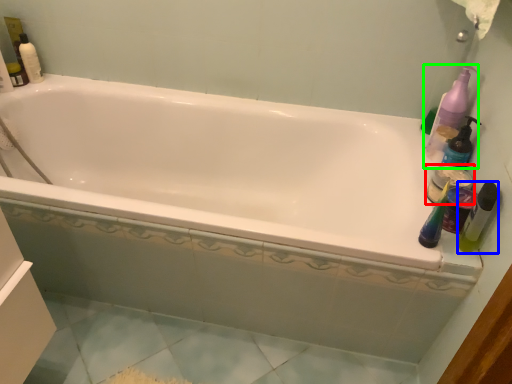
Question: Estimate the real-world distances between objects in this image. Which object is farther from mouthwash (highlighted by a red box), mouthwash (highlighted by a blue box) or cleaning product (highlighted by a green box)?

Choices:
 (A) mouthwash
 (B) cleaning product

Answer: (B)